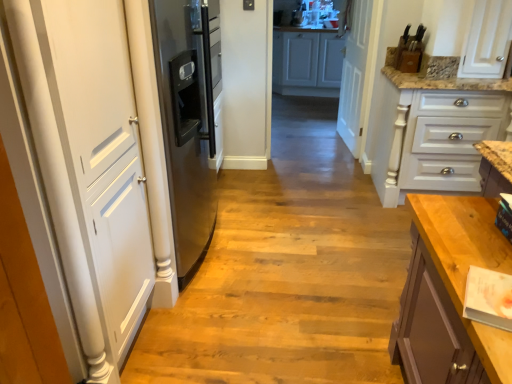
Question: Is there a large distance between white matte door at left, which ranks as the second door in back-to-front order, and white matte cabinet at center, marked as the 2th cabinetry in a front-to-back arrangement?

Choices:
 (A) no
 (B) yes

Answer: (B)

Question: Can you confirm if white matte door at left, which ranks as the second door in back-to-front order, is positioned to the right of white matte cabinet at center, marked as the 2th cabinetry in a front-to-back arrangement?

Choices:
 (A) yes
 (B) no

Answer: (B)

Question: Does white matte door at left, arranged as the 2th door when viewed from the right, have a smaller size compared to white matte cabinet at center, marked as the 2th cabinetry in a front-to-back arrangement?

Choices:
 (A) yes
 (B) no

Answer: (B)

Question: From a real-world perspective, does white matte door at left, the first door viewed from the front, stand above white matte cabinet at center, which appears as the first cabinetry when viewed from the top?

Choices:
 (A) no
 (B) yes

Answer: (B)

Question: From the image's perspective, is white matte door at left, the first door viewed from the front, under white matte cabinet at center, the first cabinetry from the back?

Choices:
 (A) yes
 (B) no

Answer: (A)

Question: Is the depth of white matte door at left, which ranks as the second door in back-to-front order, greater than that of white matte cabinet at center, which appears as the first cabinetry when viewed from the top?

Choices:
 (A) yes
 (B) no

Answer: (B)

Question: Is white wood door at center, the first door viewed from the back, oriented away from wooden floor at center?

Choices:
 (A) no
 (B) yes

Answer: (A)

Question: Can you confirm if white wood door at center, which is the 2th door in left-to-right order, is bigger than wooden floor at center?

Choices:
 (A) no
 (B) yes

Answer: (A)

Question: Is white wood door at center, the first door viewed from the back, outside of wooden floor at center?

Choices:
 (A) yes
 (B) no

Answer: (A)

Question: Is wooden floor at center a part of white wood door at center, which is the 2th door in left-to-right order?

Choices:
 (A) no
 (B) yes

Answer: (A)

Question: Can you confirm if white wood door at center, the first door viewed from the back, is shorter than wooden floor at center?

Choices:
 (A) no
 (B) yes

Answer: (A)

Question: Considering the relative sizes of white wood door at center, positioned as the 2th door in front-to-back order, and wooden floor at center in the image provided, is white wood door at center, positioned as the 2th door in front-to-back order, taller than wooden floor at center?

Choices:
 (A) no
 (B) yes

Answer: (B)

Question: Is there a large distance between wooden floor at center and white painted wood drawers at right, which is the first cabinetry in front-to-back order?

Choices:
 (A) yes
 (B) no

Answer: (B)